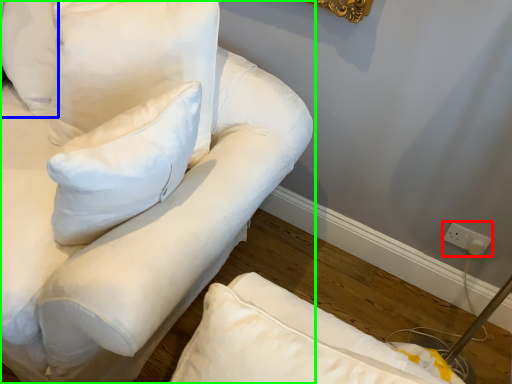
Question: Considering the real-world distances, which object is closest to electric outlet (highlighted by a red box)? pillow (highlighted by a blue box) or furniture (highlighted by a green box).

Choices:
 (A) pillow
 (B) furniture

Answer: (B)